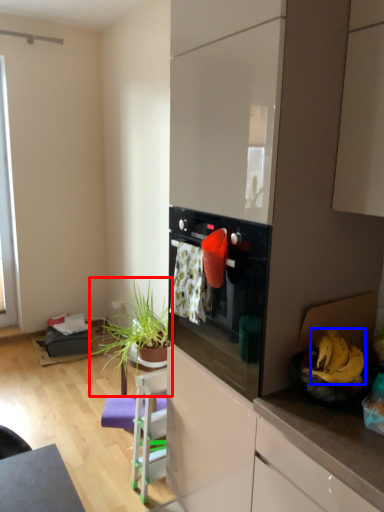
Question: Among these objects, which one is nearest to the camera, houseplant (highlighted by a red box) or banana (highlighted by a blue box)?

Choices:
 (A) houseplant
 (B) banana

Answer: (B)